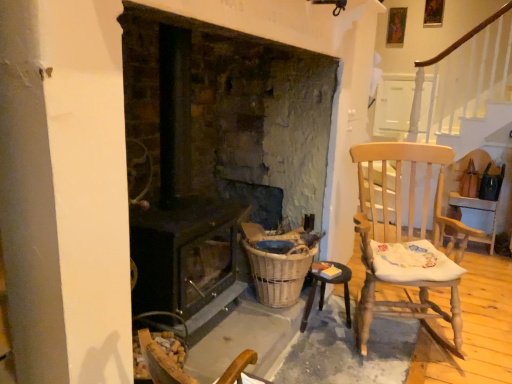
Identify the location of vacant space situated above wooden table at lower right (from a real-world perspective). The image size is (512, 384). (327, 273).